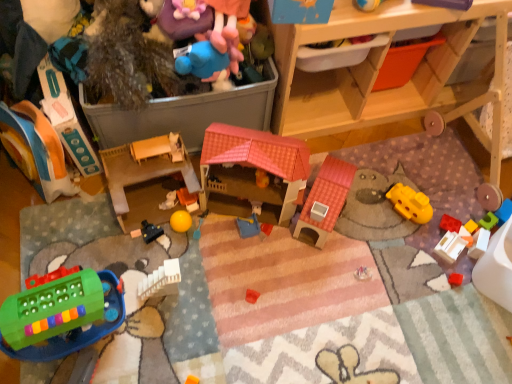
Locate an element on the screen. vacant location behind blue plastic toy at center, which is the fifth toy from right to left is located at coordinates (246, 210).